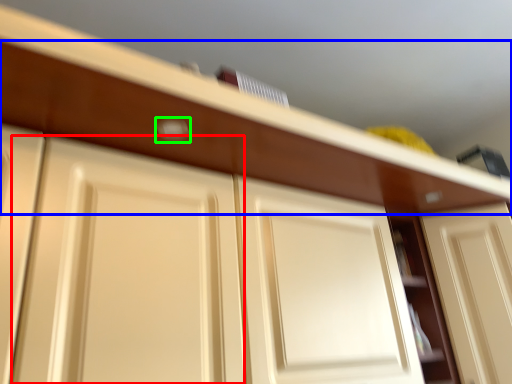
Question: Which object is the closest to the door (highlighted by a red box)? Choose among these: drawer (highlighted by a blue box) or door handle (highlighted by a green box).

Choices:
 (A) drawer
 (B) door handle

Answer: (A)